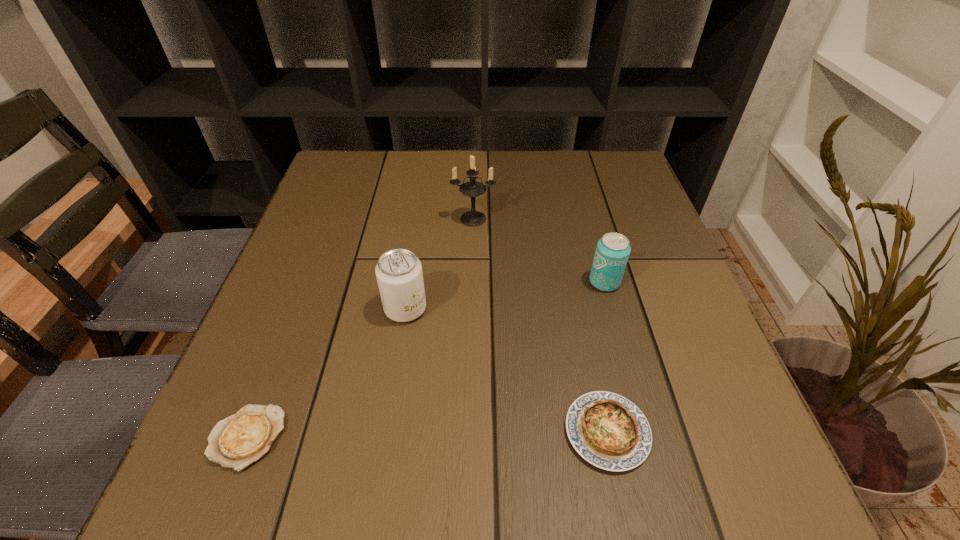
Find the location of `vacant space in between the second farthest object and the left quiche`. vacant space in between the second farthest object and the left quiche is located at coordinates (426, 360).

What are the coordinates of `blank region between the leftmost object and the beer can` in the screenshot? It's located at (426, 360).

At what (x,y) coordinates should I click in order to perform the action: click on unoccupied area between the second shortest object and the shortest object. Please return your answer as a coordinate pair (x, y). This screenshot has width=960, height=540. Looking at the image, I should click on (427, 435).

Locate an element on the screen. The height and width of the screenshot is (540, 960). unoccupied area between the right quiche and the third object from right to left is located at coordinates (540, 325).

At what (x,y) coordinates should I click in order to perform the action: click on vacant area that lies between the soda can and the second farthest object. Please return your answer as a coordinate pair (x, y). This screenshot has width=960, height=540. Looking at the image, I should click on (505, 295).

Identify the location of vacant space that is in between the third object from left to right and the right quiche. The image size is (960, 540). (540, 325).

What are the coordinates of `free space between the candle holder and the soda can` in the screenshot? It's located at (440, 264).

Point out which object is positioned as the third nearest to the left quiche. Please provide its 2D coordinates. Your answer should be formatted as a tuple, i.e. [(x, y)], where the tuple contains the x and y coordinates of a point satisfying the conditions above.

[(473, 188)]

In order to click on the closest object to the third object from left to right in this screenshot , I will do `click(399, 275)`.

Find the location of `free space that satisfies the following two spatial constraints: 1. on the back side of the shorter quiche; 2. on the right side of the candle holder`. free space that satisfies the following two spatial constraints: 1. on the back side of the shorter quiche; 2. on the right side of the candle holder is located at coordinates (332, 219).